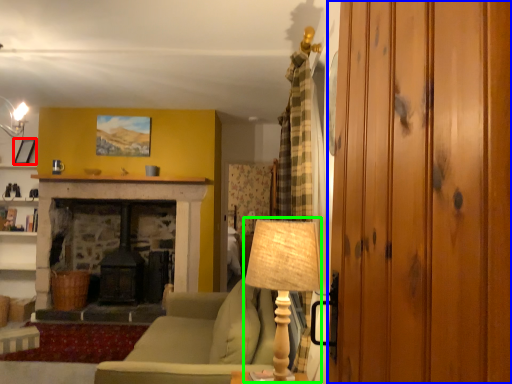
Question: Estimate the real-world distances between objects in this image. Which object is closer to picture frame (highlighted by a red box), glass door (highlighted by a blue box) or table lamp (highlighted by a green box)?

Choices:
 (A) glass door
 (B) table lamp

Answer: (B)